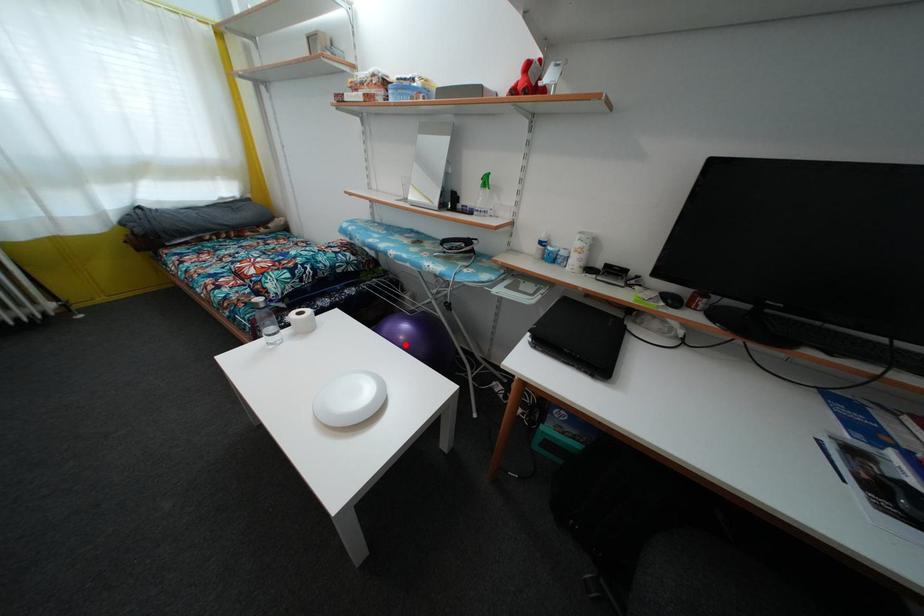
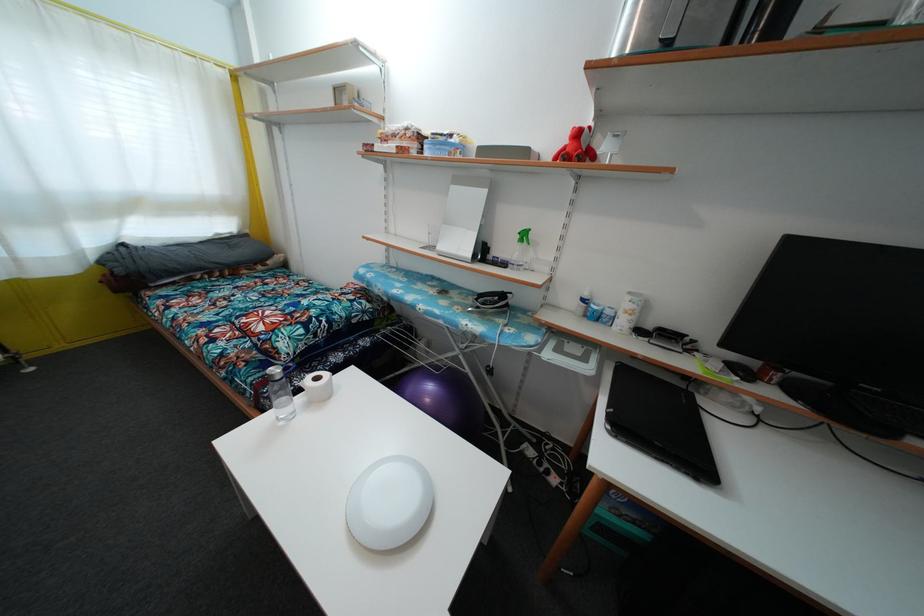
Question: A red point is marked in image1. In image2, is the corresponding 3D point closer to the camera or farther? Reply with the corresponding letter.

Choices:
 (A) The corresponding 3D point is closer.
 (B) The corresponding 3D point is farther.

Answer: (A)